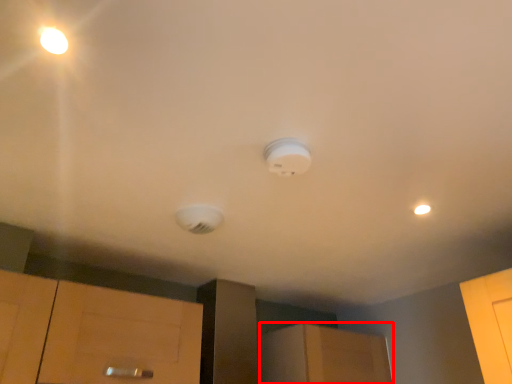
Question: From the image, what is the correct spatial relationship of cabinetry (annotated by the red box) in relation to lamp?

Choices:
 (A) left
 (B) right

Answer: (B)